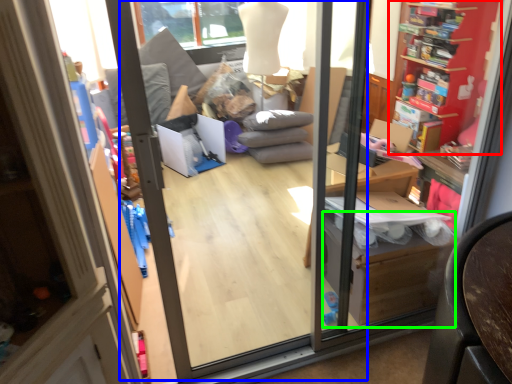
Question: Estimate the real-world distances between objects in this image. Which object is closer to shelf (highlighted by a red box), screen door (highlighted by a blue box) or cardboard box (highlighted by a green box)?

Choices:
 (A) screen door
 (B) cardboard box

Answer: (B)